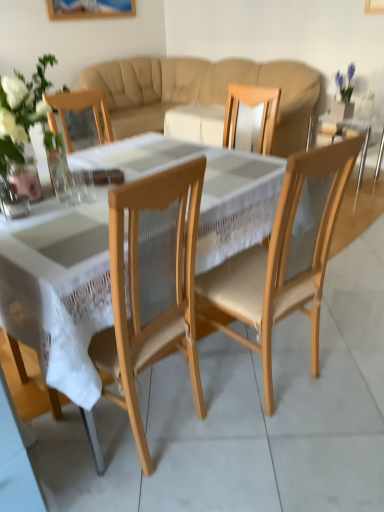
Question: Which direction should I rotate to face clear glass at center, which is the 1th tableware from left to right, — up or down?

Choices:
 (A) down
 (B) up

Answer: (B)

Question: Does natural wood chair at center have a lesser height compared to clear glass vase at left?

Choices:
 (A) no
 (B) yes

Answer: (A)

Question: From the image's perspective, is natural wood chair at center below clear glass vase at left?

Choices:
 (A) no
 (B) yes

Answer: (B)

Question: Can we say natural wood chair at center lies outside clear glass vase at left?

Choices:
 (A) no
 (B) yes

Answer: (B)

Question: From a real-world perspective, is natural wood chair at center positioned over clear glass vase at left based on gravity?

Choices:
 (A) yes
 (B) no

Answer: (B)

Question: Is natural wood chair at center positioned with its back to clear glass vase at left?

Choices:
 (A) no
 (B) yes

Answer: (A)

Question: Does natural wood chair at center touch clear glass vase at left?

Choices:
 (A) no
 (B) yes

Answer: (A)

Question: Would you say clear glass vase at left is part of clear glass at center, the second tableware in the right-to-left sequence,'s contents?

Choices:
 (A) yes
 (B) no

Answer: (B)

Question: Is clear glass at center, which is the 1th tableware from left to right, wider than clear glass vase at left?

Choices:
 (A) no
 (B) yes

Answer: (A)

Question: Is clear glass at center, which is the 1th tableware from left to right, at the left side of clear glass vase at left?

Choices:
 (A) yes
 (B) no

Answer: (B)

Question: Is the position of clear glass at center, the second tableware in the right-to-left sequence, more distant than that of clear glass vase at left?

Choices:
 (A) no
 (B) yes

Answer: (A)

Question: Can you confirm if clear glass at center, the second tableware in the right-to-left sequence, is thinner than clear glass vase at left?

Choices:
 (A) no
 (B) yes

Answer: (B)

Question: Is clear glass at center, which is the 1th tableware from left to right, positioned in front of clear glass vase at left?

Choices:
 (A) yes
 (B) no

Answer: (A)

Question: Is transparent glass at center, which is counted as the first tableware, starting from the right, inside white lace tablecloth at center?

Choices:
 (A) yes
 (B) no

Answer: (B)